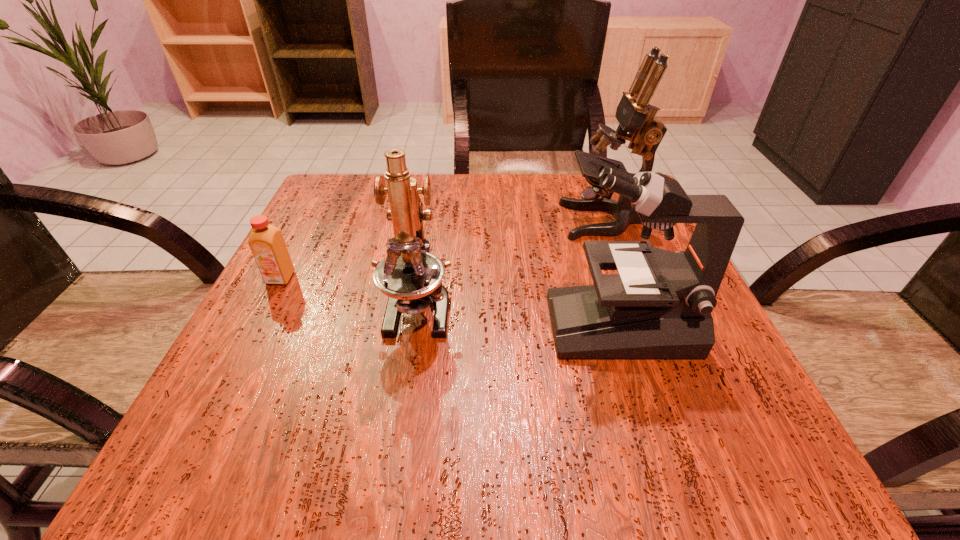
Find the location of `object present at the left edge`. object present at the left edge is located at coordinates (266, 242).

You are a GUI agent. You are given a task and a screenshot of the screen. Output one action in this format:
    pyautogui.click(x=<x>, y=<y>)
    Task: Click on the object at the far right corner
    The width and height of the screenshot is (960, 540).
    Given the screenshot: What is the action you would take?
    pyautogui.click(x=635, y=115)

Identify the location of vacant region at the far edge of the desktop. (503, 198).

Find the location of a particular element. vacant space at the near edge is located at coordinates (326, 424).

At what (x,y) coordinates should I click in order to perform the action: click on vacant space at the left edge of the desktop. Please return your answer as a coordinate pair (x, y). Looking at the image, I should click on (328, 251).

Where is `free spot at the right edge of the desktop`? This screenshot has width=960, height=540. free spot at the right edge of the desktop is located at coordinates (720, 349).

The image size is (960, 540). In the image, there is a desktop. Find the location of `blank space at the far left corner`. blank space at the far left corner is located at coordinates (335, 189).

Locate an element on the screen. This screenshot has height=540, width=960. unoccupied position between the leftmost object and the leftmost microscope is located at coordinates (349, 293).

Locate an element on the screen. Image resolution: width=960 pixels, height=540 pixels. free spot between the third object from right to left and the farthest microscope is located at coordinates (512, 264).

At what (x,y) coordinates should I click in order to perform the action: click on free point between the third object from right to left and the shortest object. Please return your answer as a coordinate pair (x, y). Looking at the image, I should click on (349, 293).